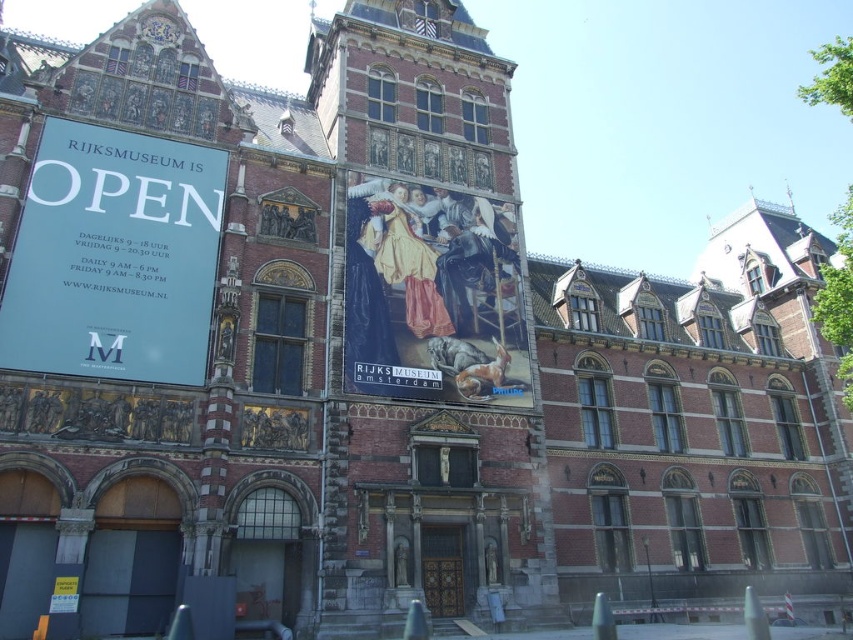
Who is more forward, (395, 285) or (161, 20)?

Point (395, 285)

Does matte oil painting at center appear under gold metallic clock at upper center?

Yes.

Who is more distant from viewer, (459,296) or (175,42)?

The point (175,42) is behind.

The image size is (853, 640). In order to click on matte oil painting at center in this screenshot , I will do `click(432, 294)`.

Between point (33, 248) and point (169, 19), which one is positioned in front?

Point (33, 248)

Which of these two, white paper sign at left or gold metallic clock at upper center, stands taller?

white paper sign at left

Where is `white paper sign at left`? This screenshot has height=640, width=853. white paper sign at left is located at coordinates (113, 257).

Which is behind, point (190, 323) or point (434, 188)?

Positioned behind is point (434, 188).

Which is in front, point (142, 186) or point (523, 336)?

Point (142, 186) is in front.

You are a GUI agent. You are given a task and a screenshot of the screen. Output one action in this format:
    pyautogui.click(x=<x>, y=<y>)
    Task: Click on the white paper sign at left
    
    Given the screenshot: What is the action you would take?
    113,257